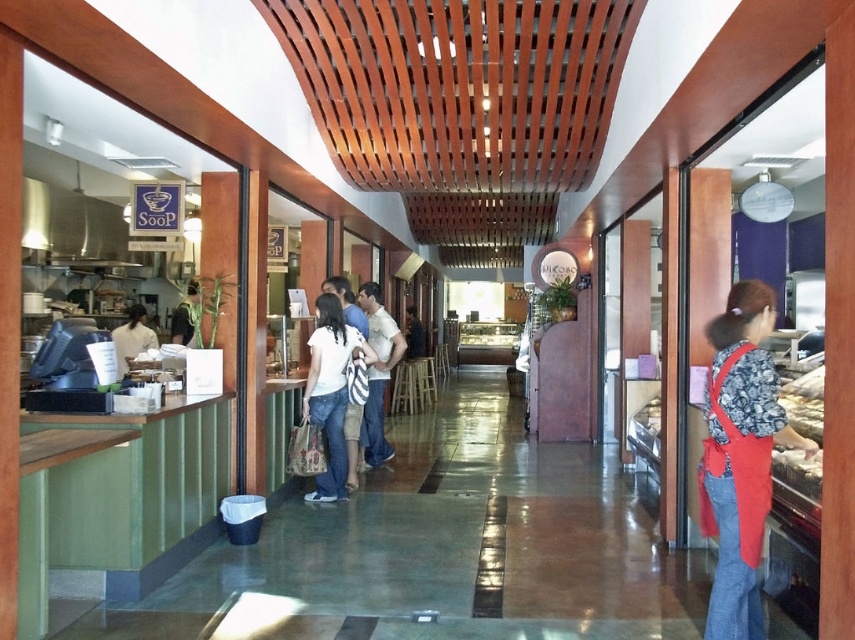
You are a customer entering the bakery and want to ask the staff wearing the white cotton shirt at center about the daily specials. The red fabric apron at right is worn by another staff member. Which staff member is standing closer to the entrance?

The red fabric apron at right is closer to the viewer than the white cotton shirt at center, so the staff member wearing the red fabric apron at right is closer to the entrance.

You are standing at the entrance of the bakery and see the point marked as point (329,388). What object is located at this point?

The point (329,388) corresponds to the white cotton shirt at center.